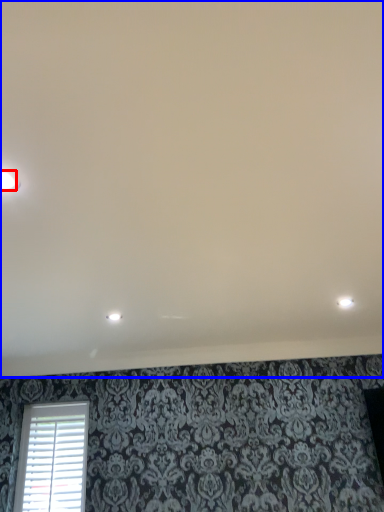
Question: Among these objects, which one is farthest to the camera, dot (highlighted by a red box) or backdrop (highlighted by a blue box)?

Choices:
 (A) dot
 (B) backdrop

Answer: (A)